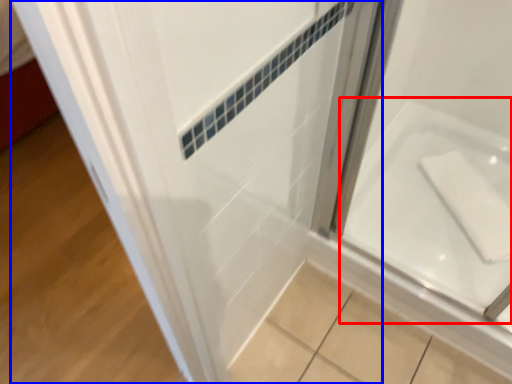
Question: Which object is further to the camera taking this photo, bath (highlighted by a red box) or door (highlighted by a blue box)?

Choices:
 (A) bath
 (B) door

Answer: (A)